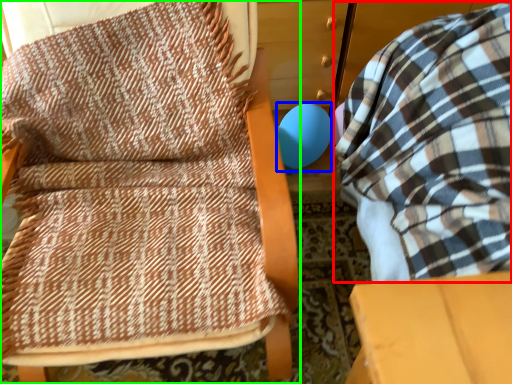
Question: Which is farther away from bean bag chair (highlighted by a red box)? balloon (highlighted by a blue box) or furniture (highlighted by a green box)?

Choices:
 (A) balloon
 (B) furniture

Answer: (A)